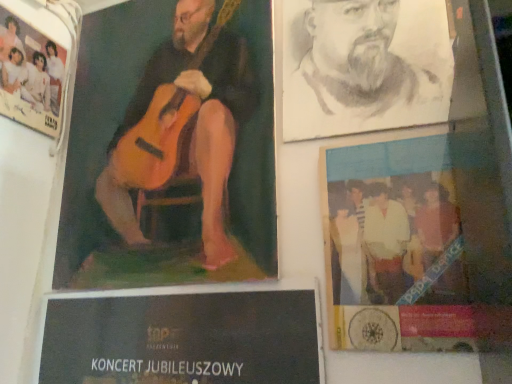
Question: Is wooden guitar at upper left, positioned as the second poster in left-to-right order, at the right side of blue glossy poster at lower right, which ranks as the 3th poster in left-to-right order?

Choices:
 (A) no
 (B) yes

Answer: (A)

Question: Is wooden guitar at upper left, the 2th poster in the right-to-left sequence, turned away from blue glossy poster at lower right, which ranks as the 3th poster in left-to-right order?

Choices:
 (A) no
 (B) yes

Answer: (A)

Question: Can you confirm if wooden guitar at upper left, the 2th poster in the right-to-left sequence, is taller than blue glossy poster at lower right, which ranks as the 1th poster in right-to-left order?

Choices:
 (A) no
 (B) yes

Answer: (B)

Question: Is wooden guitar at upper left, positioned as the second poster in left-to-right order, smaller than blue glossy poster at lower right, which ranks as the 1th poster in right-to-left order?

Choices:
 (A) no
 (B) yes

Answer: (A)

Question: Can you see wooden guitar at upper left, the 2th poster in the right-to-left sequence, touching blue glossy poster at lower right, which ranks as the 1th poster in right-to-left order?

Choices:
 (A) no
 (B) yes

Answer: (A)

Question: Considering the positions of white paper poster at upper left, acting as the 3th poster starting from the right, and blue glossy poster at lower right, which ranks as the 1th poster in right-to-left order, in the image, is white paper poster at upper left, acting as the 3th poster starting from the right, taller or shorter than blue glossy poster at lower right, which ranks as the 1th poster in right-to-left order,?

Choices:
 (A) tall
 (B) short

Answer: (B)

Question: Is white paper poster at upper left, acting as the 3th poster starting from the right, inside or outside of blue glossy poster at lower right, which ranks as the 1th poster in right-to-left order?

Choices:
 (A) outside
 (B) inside

Answer: (A)

Question: Looking at the image, does white paper poster at upper left, acting as the 3th poster starting from the right, seem bigger or smaller compared to blue glossy poster at lower right, which ranks as the 3th poster in left-to-right order?

Choices:
 (A) big
 (B) small

Answer: (B)

Question: Is white paper poster at upper left, acting as the 3th poster starting from the right, in front of or behind blue glossy poster at lower right, which ranks as the 3th poster in left-to-right order, in the image?

Choices:
 (A) behind
 (B) front

Answer: (A)

Question: In terms of width, does blue glossy poster at lower right, which ranks as the 1th poster in right-to-left order, look wider or thinner when compared to charcoal portrait of man at upper right?

Choices:
 (A) wide
 (B) thin

Answer: (B)

Question: Would you say blue glossy poster at lower right, which ranks as the 1th poster in right-to-left order, is to the left or to the right of charcoal portrait of man at upper right in the picture?

Choices:
 (A) right
 (B) left

Answer: (A)

Question: From the image's perspective, is blue glossy poster at lower right, which ranks as the 3th poster in left-to-right order, positioned above or below charcoal portrait of man at upper right?

Choices:
 (A) above
 (B) below

Answer: (B)

Question: Considering their positions, is blue glossy poster at lower right, which ranks as the 1th poster in right-to-left order, located in front of or behind charcoal portrait of man at upper right?

Choices:
 (A) behind
 (B) front

Answer: (B)

Question: Is wooden guitar at upper left, positioned as the second poster in left-to-right order, to the left or to the right of white paper poster at upper left, arranged as the first poster when viewed from the left, in the image?

Choices:
 (A) left
 (B) right

Answer: (B)

Question: Is wooden guitar at upper left, the 2th poster in the right-to-left sequence, inside or outside of white paper poster at upper left, acting as the 3th poster starting from the right?

Choices:
 (A) outside
 (B) inside

Answer: (A)